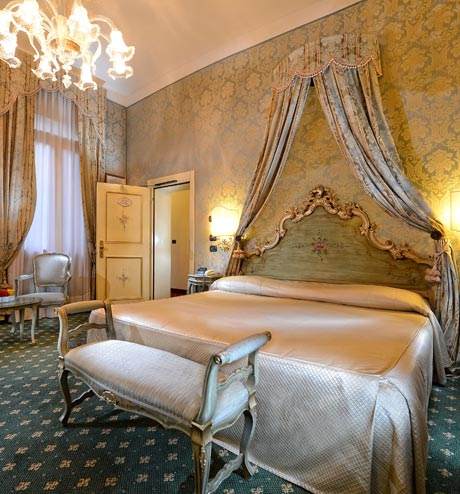
The image size is (460, 494). In order to click on 1 ceiling in this screenshot , I will do `click(169, 21)`.